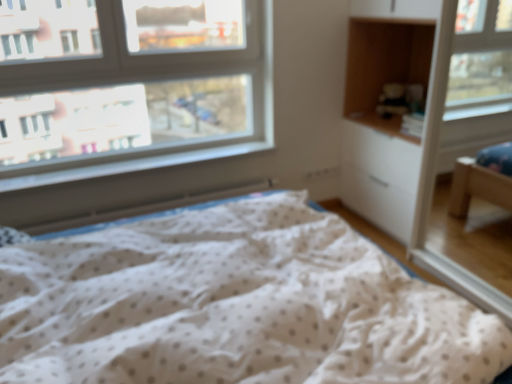
This screenshot has width=512, height=384. I want to click on vacant area on top of white plastic radiator at lower left (from a real-world perspective), so click(x=141, y=195).